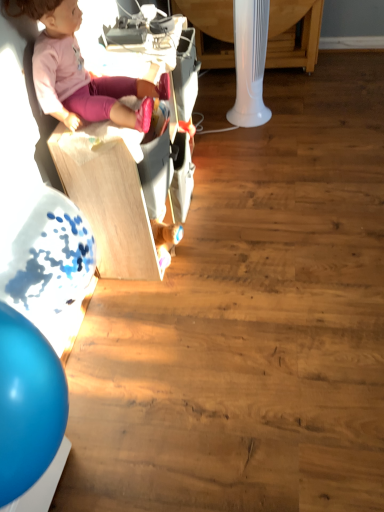
Where is `free space in front of wooden toy box at upper left`? This screenshot has height=512, width=384. free space in front of wooden toy box at upper left is located at coordinates (203, 310).